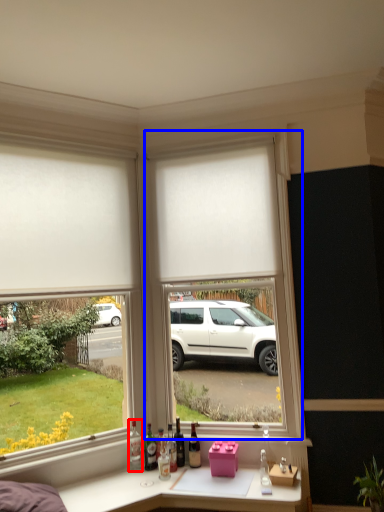
Question: Which object appears closest to the camera in this image, bottle (highlighted by a red box) or window frame (highlighted by a blue box)?

Choices:
 (A) bottle
 (B) window frame

Answer: (B)